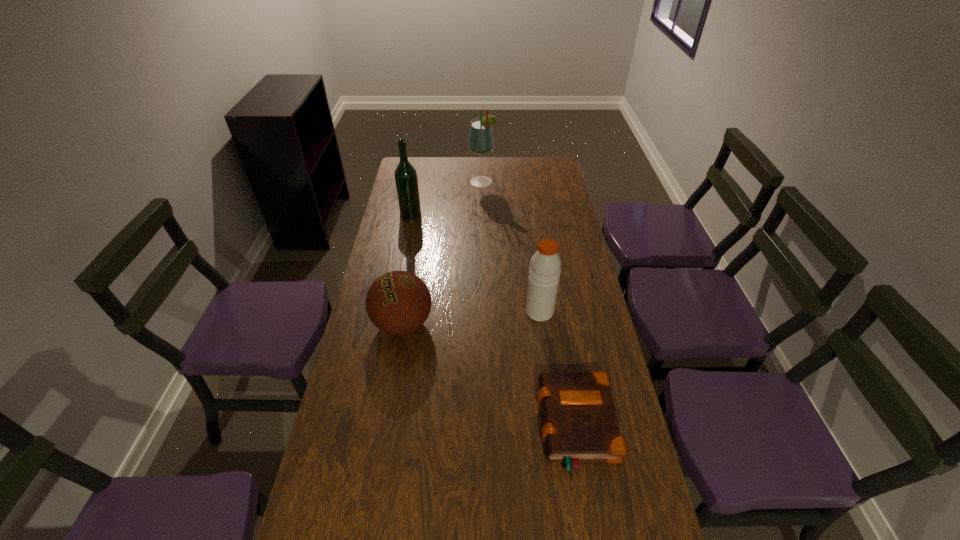
Choose which object is the third nearest neighbor to the shaker. Please provide its 2D coordinates. Your answer should be formatted as a tuple, i.e. [(x, y)], where the tuple contains the x and y coordinates of a point satisfying the conditions above.

[(406, 180)]

Locate an element on the screen. Image resolution: width=960 pixels, height=540 pixels. object that is the fourth nearest to the nearer alcohol is located at coordinates (580, 424).

At what (x,y) coordinates should I click in order to perform the action: click on free location that satisfies the following two spatial constraints: 1. on the front side of the farther alcohol; 2. on the right side of the shaker. Please return your answer as a coordinate pair (x, y). This screenshot has width=960, height=540. Looking at the image, I should click on (484, 312).